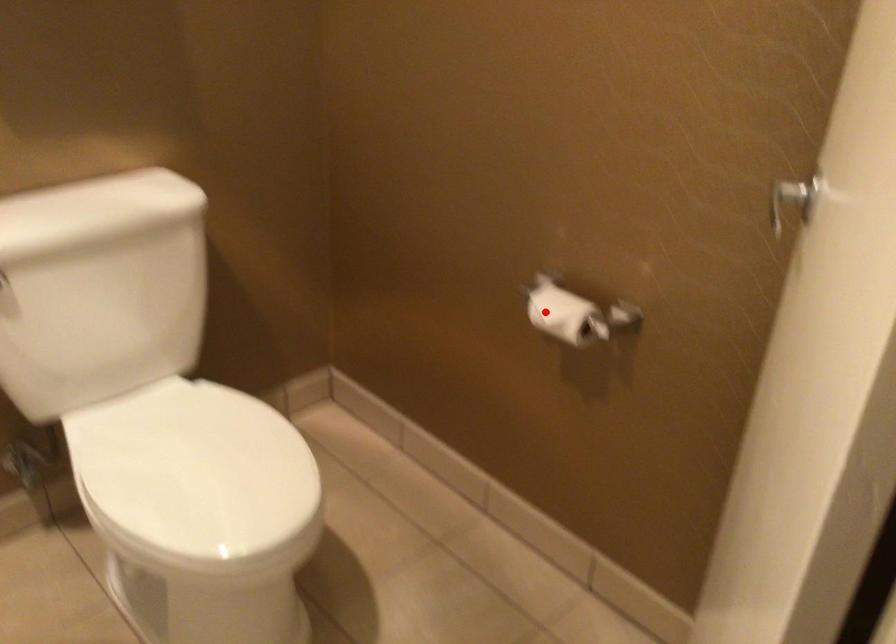
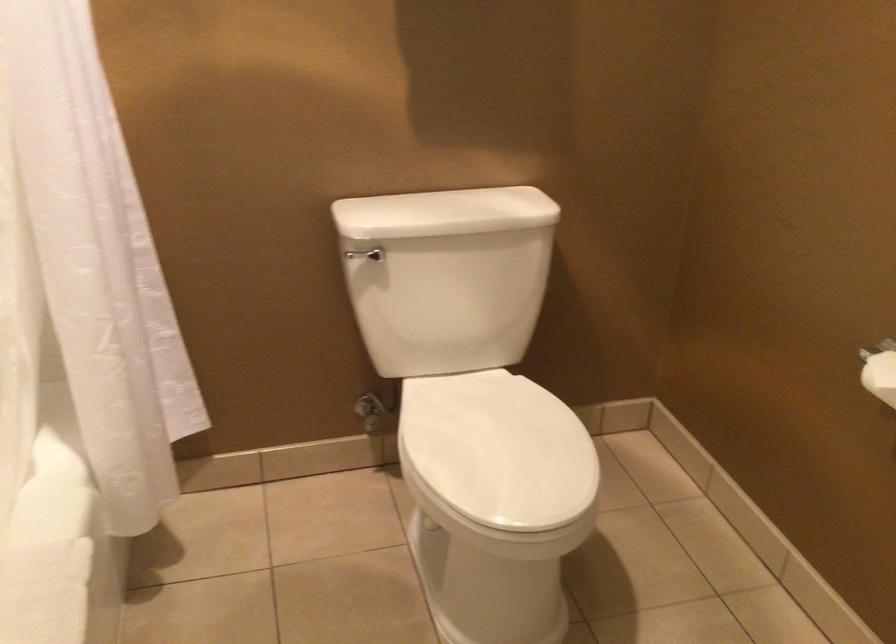
Question: A red point is marked in image1. In image2, is the corresponding 3D point closer to the camera or farther? Reply with the corresponding letter.

Choices:
 (A) The corresponding 3D point is closer.
 (B) The corresponding 3D point is farther.

Answer: (A)